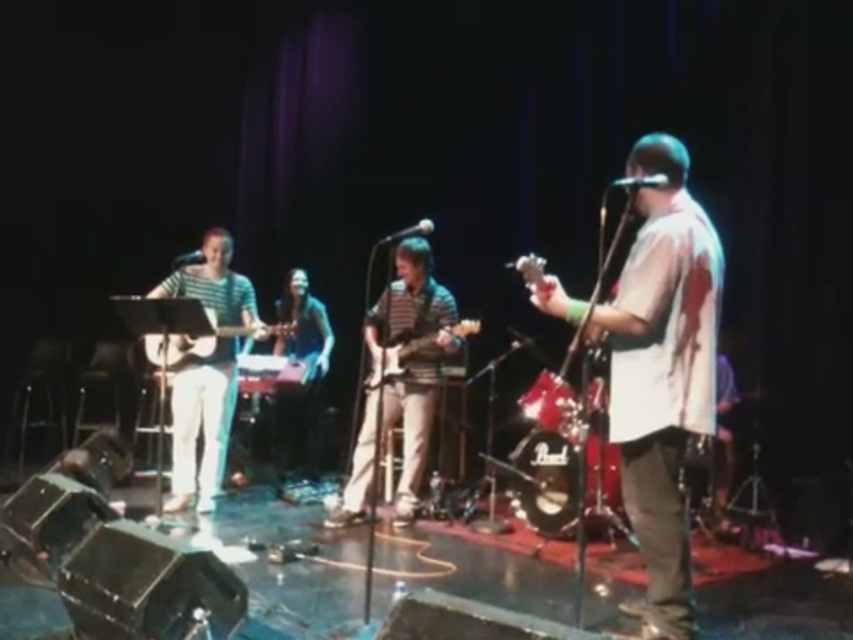
You are a stagehand preparing to move the striped fabric guitar at center and the shiny black guitar at center offstage. Based on their sizes, which guitar should you move first to ensure there is enough space for both?

The striped fabric guitar at center might be wider than the shiny black guitar at center, so you should move the striped fabric guitar at center first to accommodate its larger size before moving the shiny black guitar at center.

You are a photographer in the audience. You want to take a photo of the striped shirt at center and the glossy wood electric guitar at center. Which object should you focus on first if you want to capture both in the same frame without moving the camera?

The striped shirt at center is taller than the glossy wood electric guitar at center, so you should focus on the striped shirt at center first to ensure it is in focus, then adjust the aperture or distance if needed to include the guitar in the same plane.

You are a photographer at the back of the venue trying to take a clear photo of the glossy wood electric guitar at center. The striped shirt at center is blocking your view. Can you move to the left or right to get an unobstructed view of the guitar?

The striped shirt at center is in front of the glossy wood electric guitar at center, so moving to either the left or right might allow you to see around the obstruction caused by the striped shirt at center. However, without knowing the exact positioning of other objects or performers, it is uncertain if moving left or right will fully reveal the guitar.